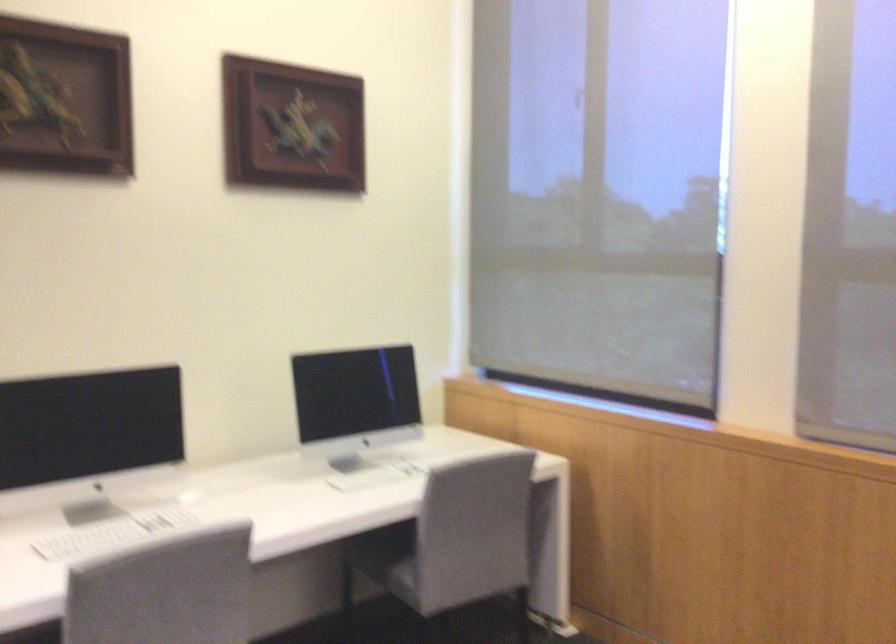
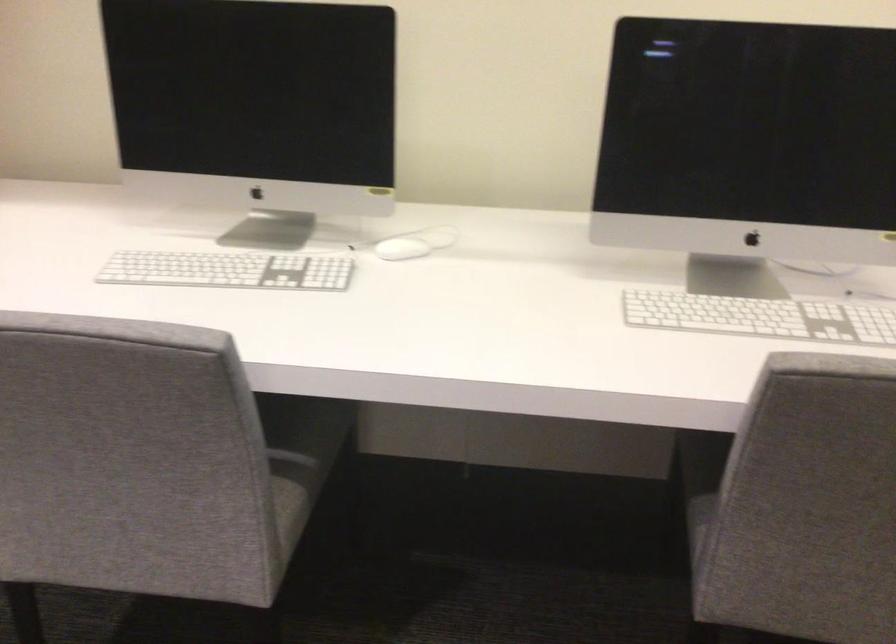
In the second image, find the point that corresponds to [391,476] in the first image.

(760, 317)